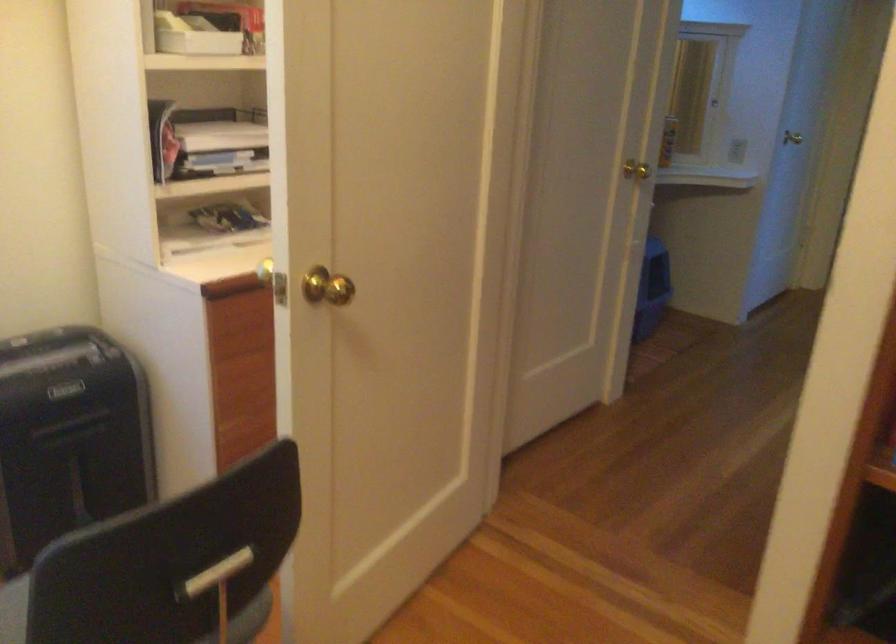
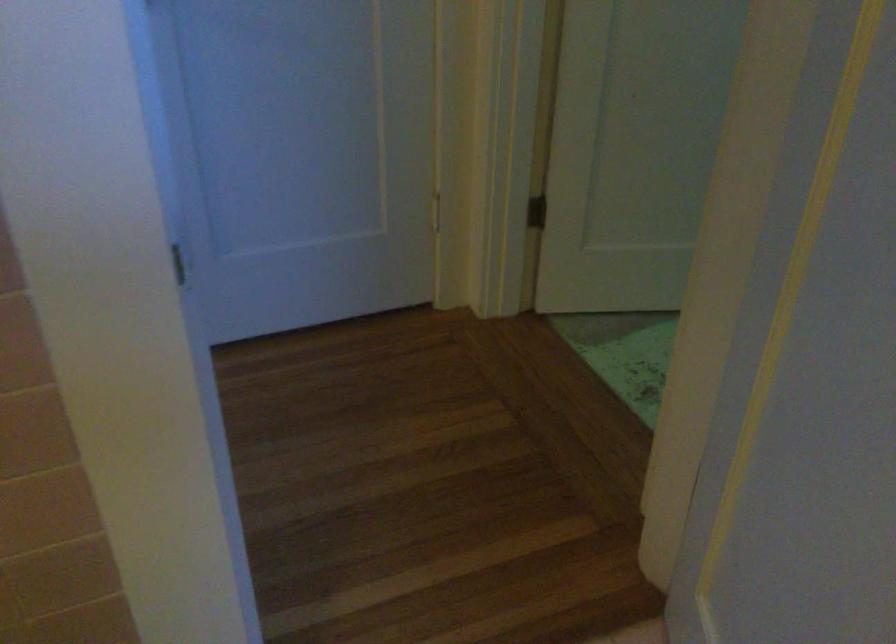
What movement of the cameraman would produce the second image?

The movement direction of the cameraman is right, forward.